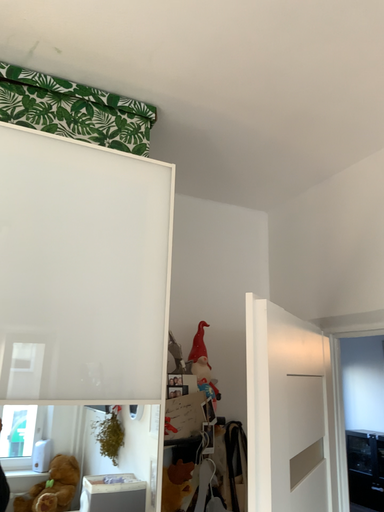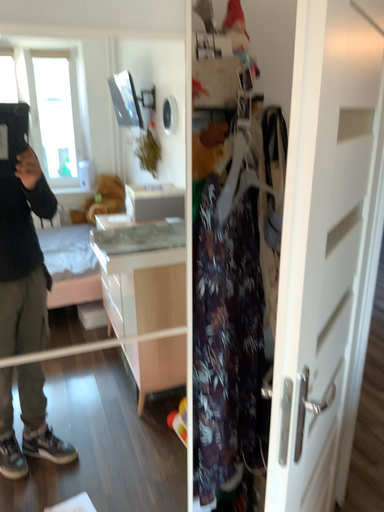
Question: Which way did the camera rotate in the video?

Choices:
 (A) rotated upward
 (B) rotated downward

Answer: (B)